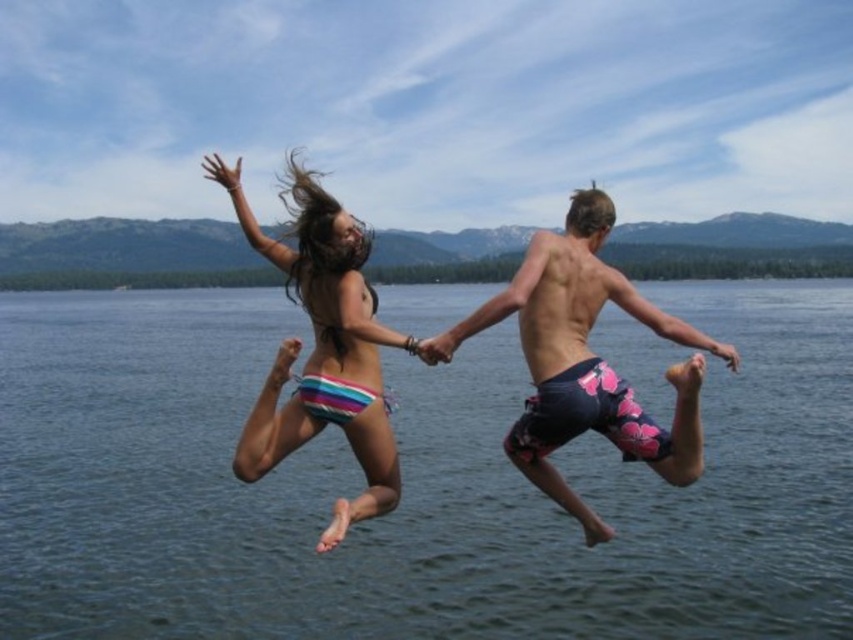
You are a photographer trying to capture the striped fabric bikini bottom at center and the clear blue water at center in a single shot. Based on their positions, which object is located to the right of the other?

The clear blue water at center is positioned on the right side of striped fabric bikini bottom at center, so the clear blue water at center is to the right of the striped fabric bikini bottom at center.

You are planning to jump into the clear blue water at center while holding the striped fabric bikini bottom at center. Can you safely jump into the water without the bikini bottom blocking your entry?

The clear blue water at center might be wider than striped fabric bikini bottom at center, so there is a possibility that you can jump safely without the bikini bottom blocking your entry, but the width difference is uncertain.